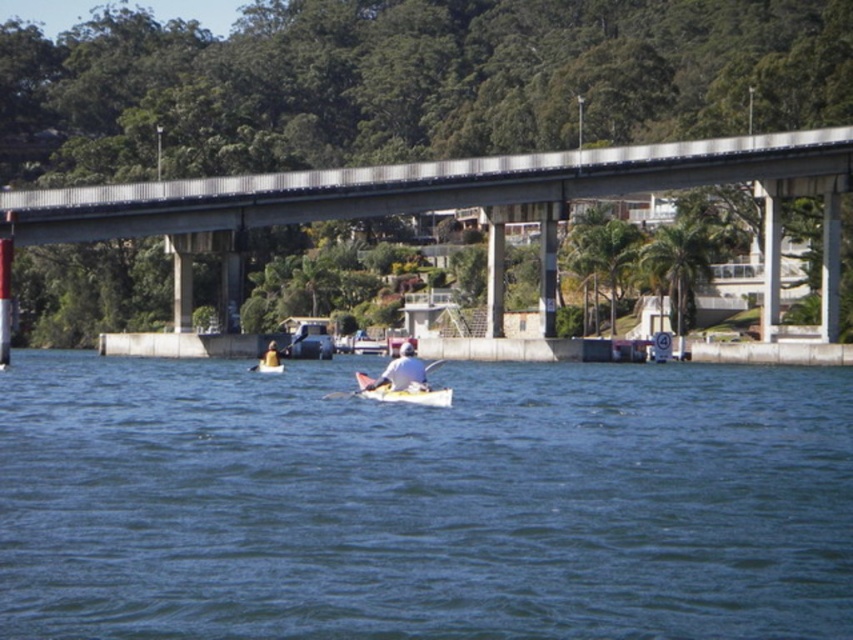
You are standing at the camera position and want to reach the white plastic canoe at center. If your walking speed is 1.5 meters per second, how many seconds will it take you to reach it?

The distance between the white plastic canoe at center and the camera is 58.05 meters. At a walking speed of 1.5 meters per second, it would take approximately 38.7 seconds to reach it.

You are a photographer standing on the bridge and want to capture both the white plastic canoe at center and the yellow matte kayak at center in a single shot. Based on their positions, which one will appear closer to the camera in the photo?

The white plastic canoe at center will appear closer to the camera in the photo because it is positioned in front of the yellow matte kayak at center.

You are a photographer standing on the bridge and want to capture both the white plastic canoe at center and the yellow matte kayak at center in a single photo. The camera you have can only focus on objects within a 20 meter range. Will you be able to include both in the photo without moving the camera?

The white plastic canoe at center and yellow matte kayak at center are 21.00 meters apart from each other. Since the camera can only focus on objects within a 20 meter range, the distance between them exceeds the camera range. Therefore, you cannot include both in the photo without moving the camera.